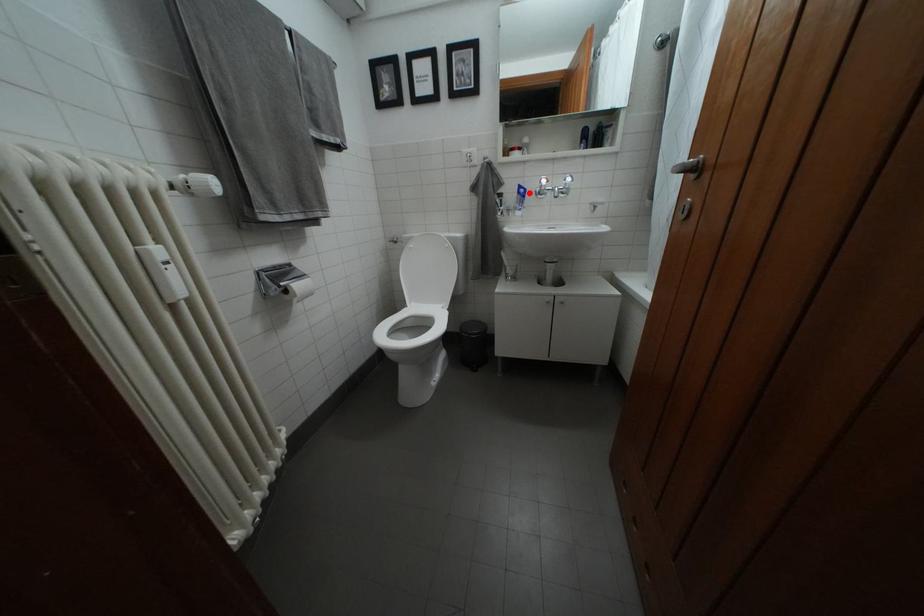
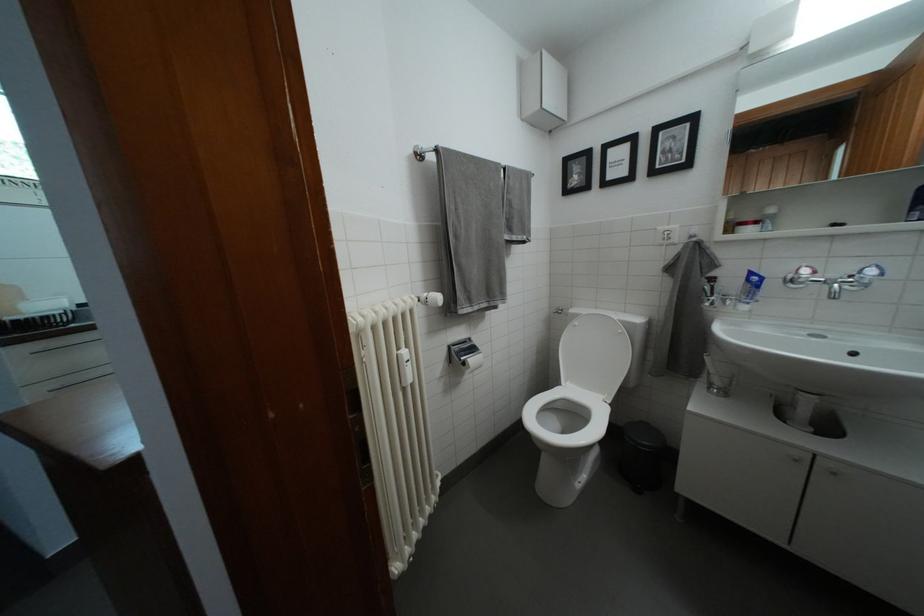
Question: I am providing you with two images of the same scene from different viewpoints. Image1 has a red point marked. In image2, the corresponding 3D location appears at what relative position? Reply with the corresponding letter.

Choices:
 (A) Closer
 (B) Farther

Answer: (B)